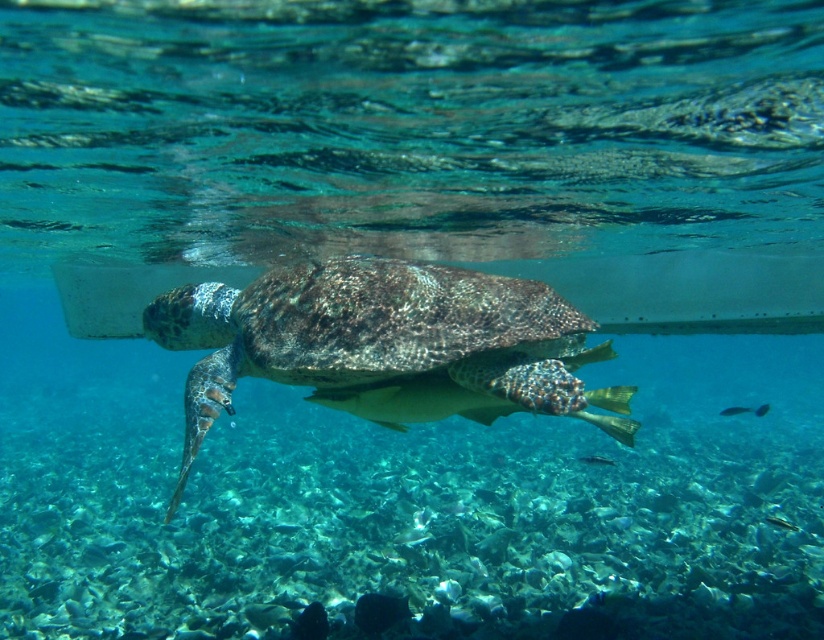
Between textured brown tortoise at center and shiny blue fish at lower right, which one is positioned higher?

textured brown tortoise at center

How distant is textured brown tortoise at center from shiny blue fish at lower right?

textured brown tortoise at center and shiny blue fish at lower right are 7.31 meters apart.

Is point (448, 316) farther from viewer compared to point (727, 413)?

No, it is in front of (727, 413).

Where is `textured brown tortoise at center`? textured brown tortoise at center is located at coordinates (386, 346).

Is shiny blue fish at lower right smaller than shiny silver fish at center?

No.

Is shiny blue fish at lower right taller than shiny silver fish at center?

Indeed, shiny blue fish at lower right has a greater height compared to shiny silver fish at center.

Which is behind, point (752, 412) or point (762, 412)?

The point (752, 412) is behind.

Find the location of `shiny blue fish at lower right`. shiny blue fish at lower right is located at coordinates (745, 410).

Is point (228, 356) positioned in front of point (761, 404)?

That is True.

Is textured brown tortoise at center shorter than shiny silver fish at center?

Yes, textured brown tortoise at center is shorter than shiny silver fish at center.

Describe the element at coordinates (386, 346) in the screenshot. I see `textured brown tortoise at center` at that location.

The image size is (824, 640). I want to click on textured brown tortoise at center, so click(x=386, y=346).